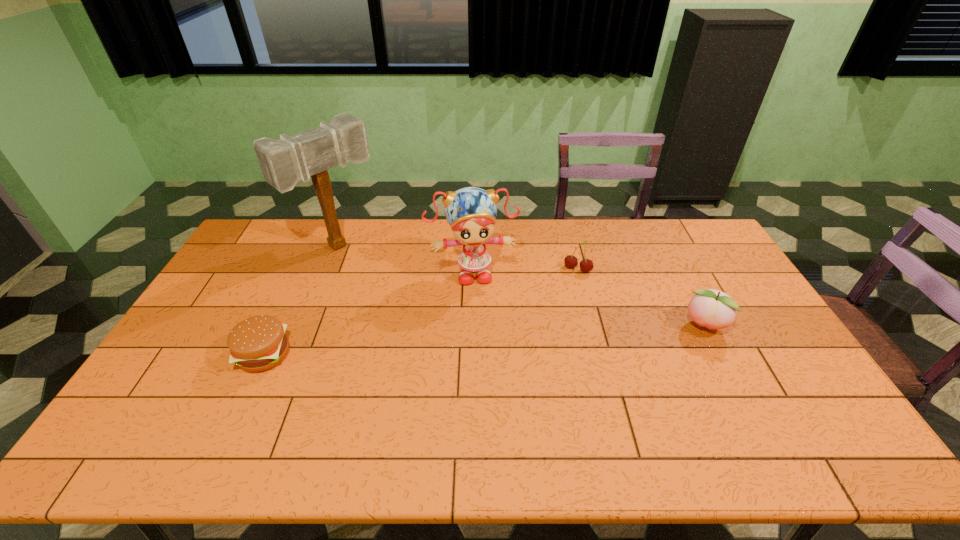
This screenshot has width=960, height=540. Identify the location of hamburger. (258, 343).

Locate an element on the screen. peach is located at coordinates (713, 309).

Identify the location of the second object from right to left. This screenshot has height=540, width=960. (586, 265).

You are a GUI agent. You are given a task and a screenshot of the screen. Output one action in this format:
    pyautogui.click(x=<x>, y=<y>)
    Task: Click on the third object from right to left
    
    Given the screenshot: What is the action you would take?
    pyautogui.click(x=471, y=212)

Locate an element on the screen. The height and width of the screenshot is (540, 960). doll is located at coordinates (471, 212).

This screenshot has height=540, width=960. Identify the location of the tallest object. (283, 162).

Find the location of `vacant area situated 0.200m on the right of the shortest object`. vacant area situated 0.200m on the right of the shortest object is located at coordinates (360, 354).

Find the location of a particular element. free space located 0.080m on the back of the peach is located at coordinates (687, 294).

What are the coordinates of `vacant point located on the surface of the second object from right to left` in the screenshot? It's located at (544, 329).

This screenshot has width=960, height=540. I want to click on free location located 0.210m on the surface of the second object from right to left, so click(552, 314).